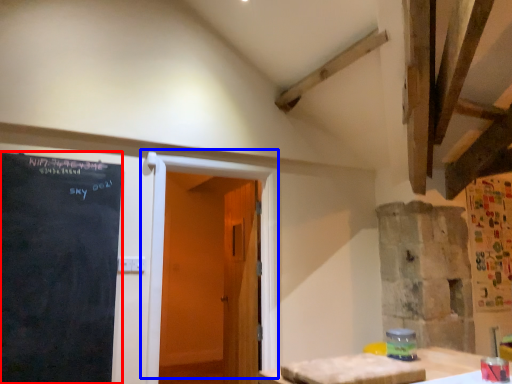
Question: Which point is further to the camera, blackboard (highlighted by a red box) or door (highlighted by a blue box)?

Choices:
 (A) blackboard
 (B) door

Answer: (B)